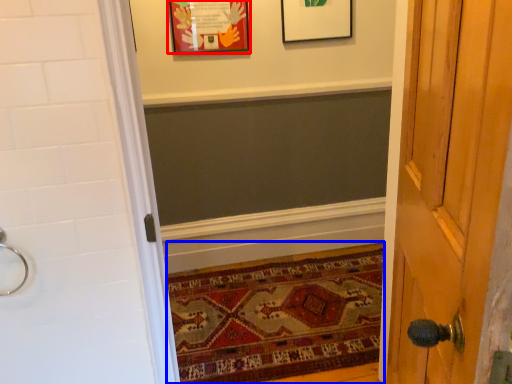
Question: Which of the following is the closest to the observer, picture frame (highlighted by a red box) or mat (highlighted by a blue box)?

Choices:
 (A) picture frame
 (B) mat

Answer: (B)